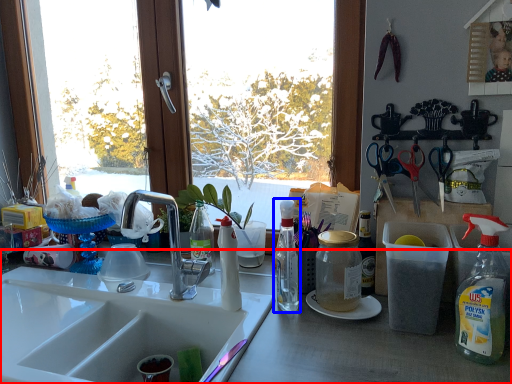
Question: Among these objects, which one is farthest to the camera, desk (highlighted by a red box) or bottle (highlighted by a blue box)?

Choices:
 (A) desk
 (B) bottle

Answer: (B)